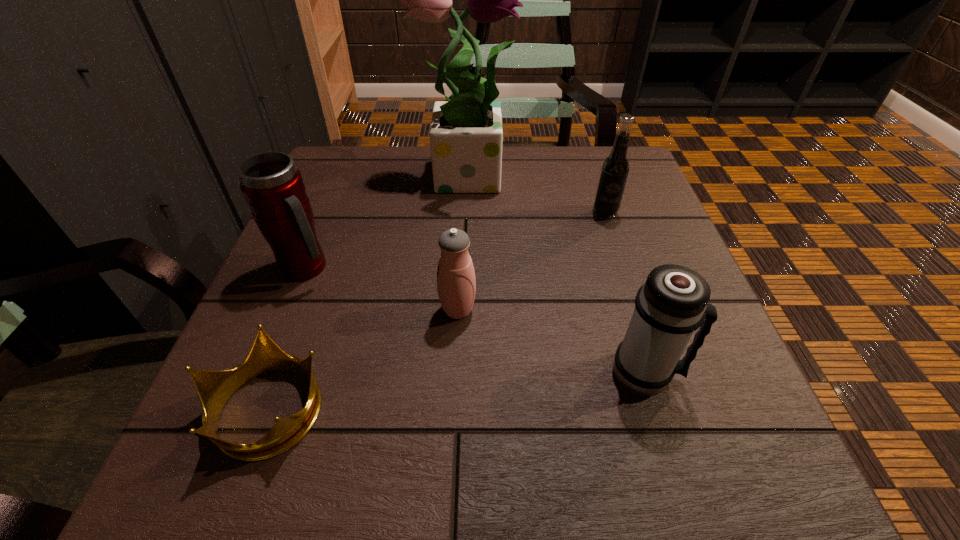
Identify the location of flower arrangement. (466, 135).

Image resolution: width=960 pixels, height=540 pixels. In order to click on the farthest object in this screenshot , I will do `click(466, 135)`.

You are a GUI agent. You are given a task and a screenshot of the screen. Output one action in this format:
    pyautogui.click(x=<x>, y=<y>)
    Task: Click on the second farthest object
    The width and height of the screenshot is (960, 540).
    Given the screenshot: What is the action you would take?
    pyautogui.click(x=615, y=167)

Identify the location of the leftmost thermos bottle. The image size is (960, 540). [x=272, y=186].

Where is `the farthest thermos bottle`? The image size is (960, 540). the farthest thermos bottle is located at coordinates (272, 186).

Where is `the nearest thermos bottle`? The image size is (960, 540). the nearest thermos bottle is located at coordinates (672, 304).

I want to click on the second nearest thermos bottle, so click(456, 284).

Image resolution: width=960 pixels, height=540 pixels. I want to click on the second thermos bottle from right to left, so click(x=456, y=284).

Identify the location of crown. The height and width of the screenshot is (540, 960). (214, 388).

This screenshot has width=960, height=540. Find the location of `vacant region located 0.310m on the front-facing side of the tallest object`. vacant region located 0.310m on the front-facing side of the tallest object is located at coordinates (639, 172).